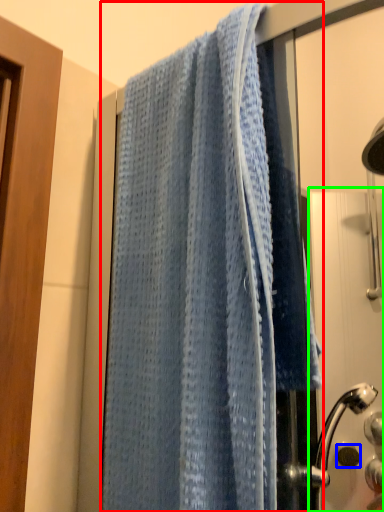
Question: Which is farther away from towel (highlighted by a red box)? knob (highlighted by a blue box) or screen door (highlighted by a green box)?

Choices:
 (A) knob
 (B) screen door

Answer: (A)